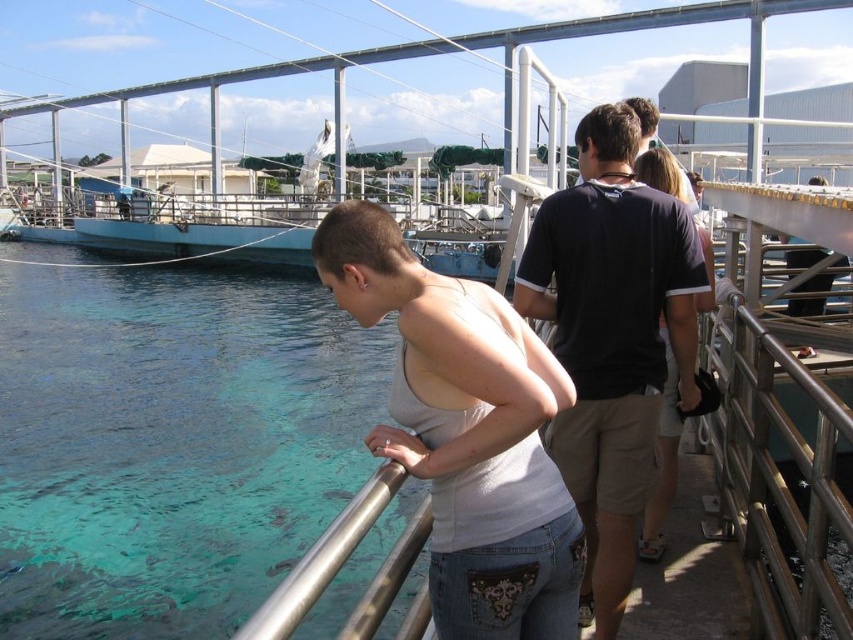
Which of these two, white matte tank top at center or black cotton shirt at center, stands shorter?

Standing shorter between the two is white matte tank top at center.

Can you confirm if white matte tank top at center is bigger than black cotton shirt at center?

Indeed, white matte tank top at center has a larger size compared to black cotton shirt at center.

Is point (590, 353) positioned behind point (643, 480)?

Yes, it is behind point (643, 480).

The height and width of the screenshot is (640, 853). I want to click on white matte tank top at center, so click(x=610, y=340).

Is clear blue water at lower left below white matte tank top at center?

Correct, clear blue water at lower left is located below white matte tank top at center.

Looking at this image, who is more distant from viewer, (105, 346) or (631, 339)?

The point (105, 346) is behind.

Where is `clear blue water at lower left`? This screenshot has height=640, width=853. clear blue water at lower left is located at coordinates (184, 452).

Is black cotton shirt at center taller than metallic silver railing at right?

Yes.

Does point (590, 252) lie behind point (850, 548)?

Yes, point (590, 252) is farther from viewer.

What are the coordinates of `black cotton shirt at center` in the screenshot? It's located at (612, 339).